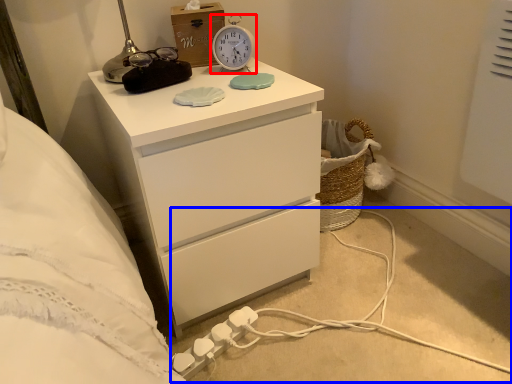
Question: Which point is further to the camera, alarm clock (highlighted by a red box) or cable (highlighted by a blue box)?

Choices:
 (A) alarm clock
 (B) cable

Answer: (A)